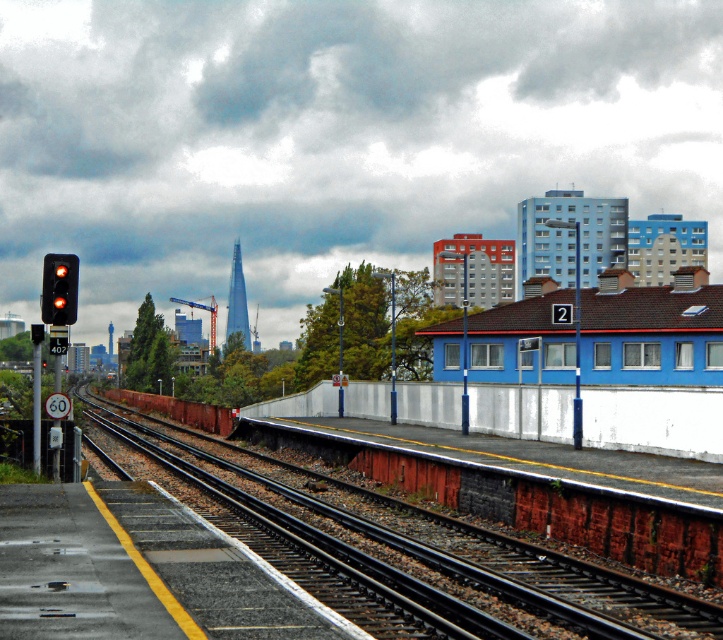
Question: Does blue matte building at center-right have a greater width compared to red glass traffic light at left?

Choices:
 (A) no
 (B) yes

Answer: (B)

Question: Which object appears farthest from the camera in this image?

Choices:
 (A) red glass traffic light at left
 (B) smooth concrete track at center
 (C) blue matte building at center-right

Answer: (C)

Question: Among these points, which one is nearest to the camera?

Choices:
 (A) (48, 253)
 (B) (367, 566)

Answer: (B)

Question: Where is smooth concrete track at center located in relation to blue matte building at center-right in the image?

Choices:
 (A) above
 (B) below

Answer: (B)

Question: Is blue matte building at center-right smaller than red glass traffic light at left?

Choices:
 (A) no
 (B) yes

Answer: (A)

Question: Which object is the farthest from the red glass traffic light at left?

Choices:
 (A) smooth concrete track at center
 (B) blue matte building at center-right

Answer: (B)